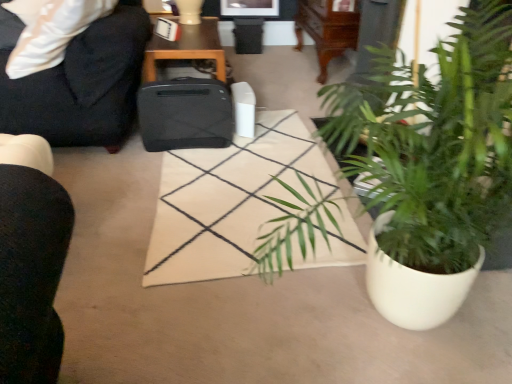
Question: Is black wood table at upper center at the left side of black fabric chair at upper left?

Choices:
 (A) no
 (B) yes

Answer: (A)

Question: Can you confirm if black wood table at upper center is wider than black fabric chair at upper left?

Choices:
 (A) yes
 (B) no

Answer: (B)

Question: From a real-world perspective, is black wood table at upper center on black fabric chair at upper left?

Choices:
 (A) yes
 (B) no

Answer: (B)

Question: Is black wood table at upper center next to black fabric chair at upper left and touching it?

Choices:
 (A) yes
 (B) no

Answer: (B)

Question: Is black wood table at upper center taller than black fabric chair at upper left?

Choices:
 (A) no
 (B) yes

Answer: (A)

Question: From a real-world perspective, is black wood table at upper center physically located above or below black plastic trash can at center?

Choices:
 (A) below
 (B) above

Answer: (B)

Question: In the image, is black wood table at upper center positioned in front of or behind black plastic trash can at center?

Choices:
 (A) behind
 (B) front

Answer: (B)

Question: Looking at the image, does black wood table at upper center seem bigger or smaller compared to black plastic trash can at center?

Choices:
 (A) small
 (B) big

Answer: (B)

Question: Is black wood table at upper center taller or shorter than black plastic trash can at center?

Choices:
 (A) short
 (B) tall

Answer: (B)

Question: From a real-world perspective, is black wood table at upper center positioned above or below green leafy plant in white pot at lower right?

Choices:
 (A) below
 (B) above

Answer: (A)

Question: In terms of size, does black wood table at upper center appear bigger or smaller than green leafy plant in white pot at lower right?

Choices:
 (A) small
 (B) big

Answer: (A)

Question: In terms of height, does black wood table at upper center look taller or shorter compared to green leafy plant in white pot at lower right?

Choices:
 (A) short
 (B) tall

Answer: (A)

Question: Relative to green leafy plant in white pot at lower right, is black wood table at upper center in front or behind?

Choices:
 (A) behind
 (B) front

Answer: (A)

Question: Is black plastic trash can at center bigger or smaller than black matte suitcase at center?

Choices:
 (A) small
 (B) big

Answer: (A)

Question: Is black plastic trash can at center in front of or behind black matte suitcase at center in the image?

Choices:
 (A) front
 (B) behind

Answer: (B)